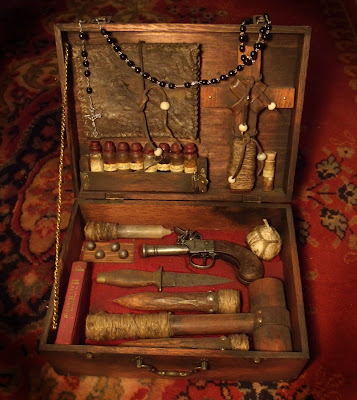
Where is `candle`? The height and width of the screenshot is (400, 357). candle is located at coordinates (141, 232).